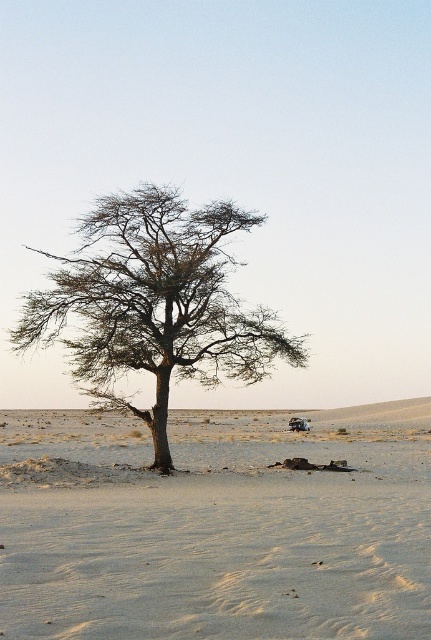
Between sandy beige sand at center and brown textured tree at center, which one is positioned lower?

Positioned lower is sandy beige sand at center.

Who is more forward, (x=74, y=554) or (x=147, y=196)?

Point (x=74, y=554)

At what (x,y) coordinates should I click in order to perform the action: click on sandy beige sand at center. Please return your answer as a coordinate pair (x, y). Looking at the image, I should click on (215, 525).